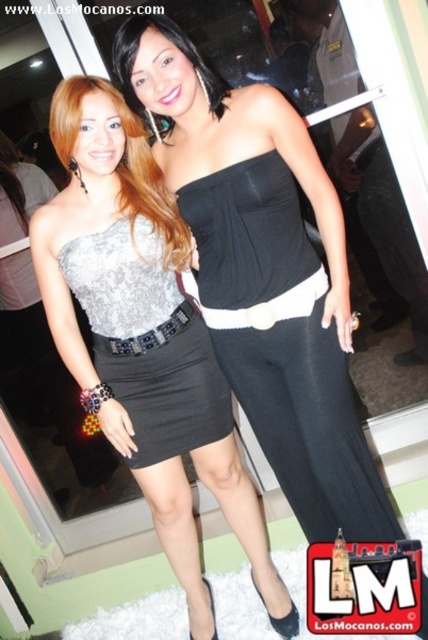
Locate an element on the screen. The image size is (428, 640). matte black dress at center is located at coordinates (184, 58).

Is matte black dress at center bigger than black leather belt at center?

Yes, matte black dress at center is bigger than black leather belt at center.

This screenshot has width=428, height=640. Identify the location of matte black dress at center. (184, 58).

Can you confirm if black satin strapless dress at center is taller than black leather belt at center?

Yes.

Does point (321, 513) come closer to viewer compared to point (190, 304)?

That is True.

Who is more forward, (199, 228) or (171, 330)?

Positioned in front is point (199, 228).

The image size is (428, 640). Identify the location of black satin strapless dress at center. (308, 422).

Is silver sequined dress at left in front of matte black dress at center?

No.

Between silver sequined dress at left and matte black dress at center, which one is positioned higher?

matte black dress at center is higher up.

Does point (157, 428) come in front of point (168, 36)?

No.

Identify the location of silver sequined dress at left. Image resolution: width=428 pixels, height=640 pixels. (142, 333).